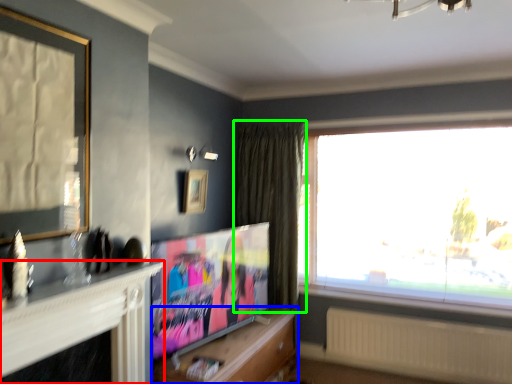
Question: Considering the real-world distances, which object is farthest from fireplace (highlighted by a red box)? cabinetry (highlighted by a blue box) or curtain (highlighted by a green box)?

Choices:
 (A) cabinetry
 (B) curtain

Answer: (B)